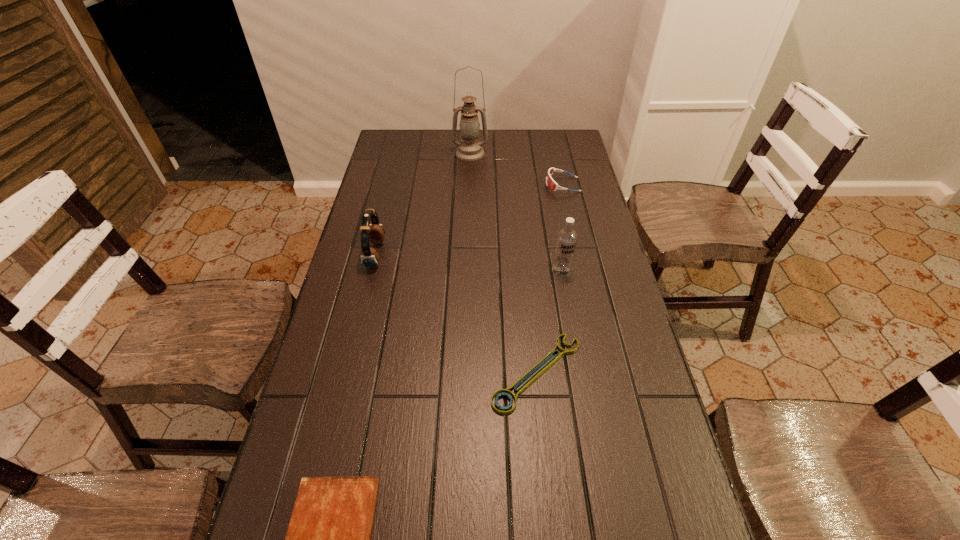
Image resolution: width=960 pixels, height=540 pixels. Find the location of `vacant space at the left edge of the desktop`. vacant space at the left edge of the desktop is located at coordinates (380, 197).

Image resolution: width=960 pixels, height=540 pixels. Find the location of `free point at the right edge`. free point at the right edge is located at coordinates [644, 451].

Where is `free space at the far left corner of the desktop`? The width and height of the screenshot is (960, 540). free space at the far left corner of the desktop is located at coordinates click(416, 136).

Locate an element on the screen. The width and height of the screenshot is (960, 540). free space at the far right corner of the desktop is located at coordinates (570, 152).

Where is `free space between the tallest object and the second tallest object`? Image resolution: width=960 pixels, height=540 pixels. free space between the tallest object and the second tallest object is located at coordinates (516, 212).

Locate an element on the screen. Image resolution: width=960 pixels, height=540 pixels. vacant area that lies between the shortest object and the farthest object is located at coordinates (503, 263).

Identify the location of empty location between the shortest object and the vodka. (549, 322).

This screenshot has width=960, height=540. Identify the location of free space between the shortest object and the tallest object. (503, 263).

Find the location of a particular element. The height and width of the screenshot is (540, 960). empty space between the vodka and the fifth nearest object is located at coordinates (562, 228).

At what (x,y) coordinates should I click in order to perform the action: click on free space between the headset and the second tallest object. Please return your answer as a coordinate pair (x, y). Looking at the image, I should click on (468, 263).